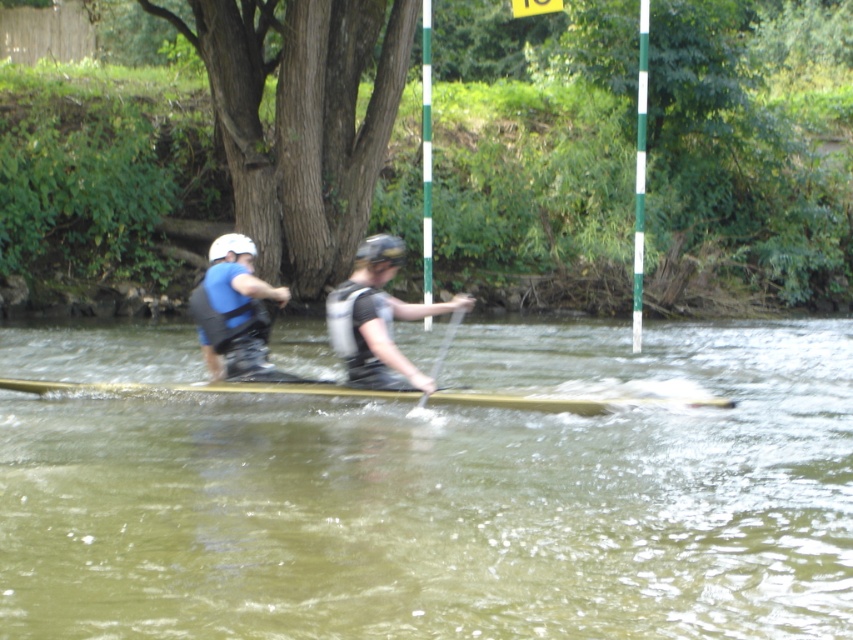
Question: Considering the real-world distances, which object is closest to the wooden canoe at center?

Choices:
 (A) matte black wetsuit at center
 (B) blue matte life vest at left
 (C) smooth wood paddle at center
 (D) greenish murky water at center

Answer: (B)

Question: Does greenish murky water at center have a greater width compared to wooden canoe at center?

Choices:
 (A) yes
 (B) no

Answer: (A)

Question: Among these objects, which one is nearest to the camera?

Choices:
 (A) matte black wetsuit at center
 (B) wooden canoe at center

Answer: (A)

Question: Considering the real-world distances, which object is farthest from the matte black wetsuit at center?

Choices:
 (A) greenish murky water at center
 (B) smooth wood paddle at center
 (C) blue matte life vest at left
 (D) wooden canoe at center

Answer: (D)

Question: Can you confirm if matte black wetsuit at center is positioned below blue matte life vest at left?

Choices:
 (A) no
 (B) yes

Answer: (A)

Question: In this image, where is blue matte life vest at left located relative to smooth wood paddle at center?

Choices:
 (A) left
 (B) right

Answer: (A)